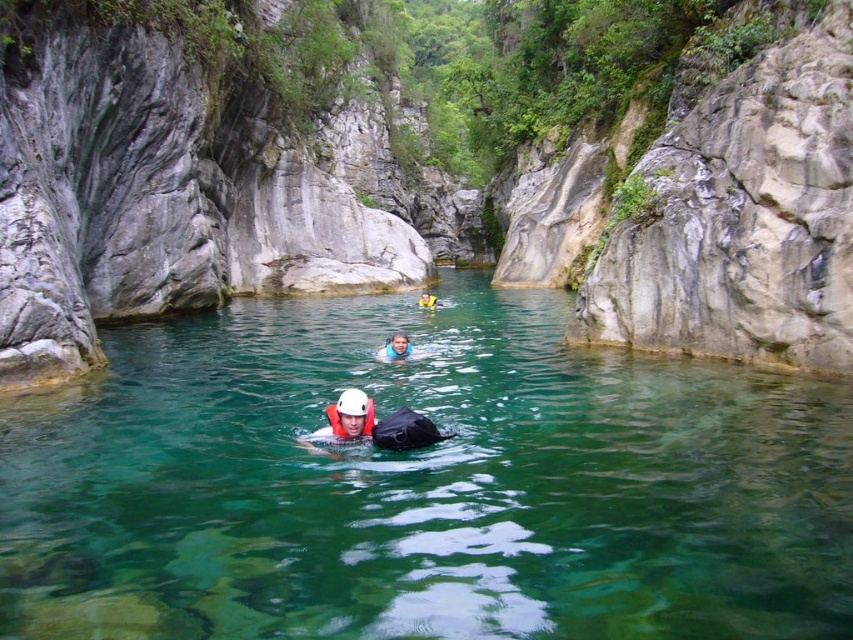
You are a safety inspector assessing the equipment of two swimmers in the canyon. You notice the blue fabric at center and the orange life jacket at center. Which piece of equipment is taller?

The blue fabric at center is taller than the orange life jacket at center.

You are a safety inspector assessing the canyon scene. You notice the clear water at center and the yellow life vest at center. Based on their positions, which one is higher from the ground?

The clear water at center is taller than the yellow life vest at center, so the clear water at center is higher from the ground.